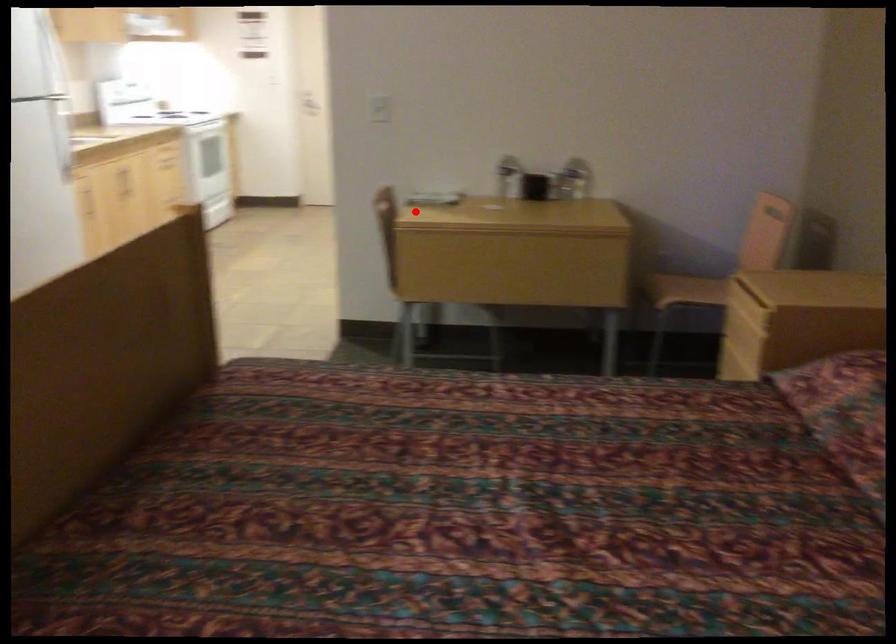
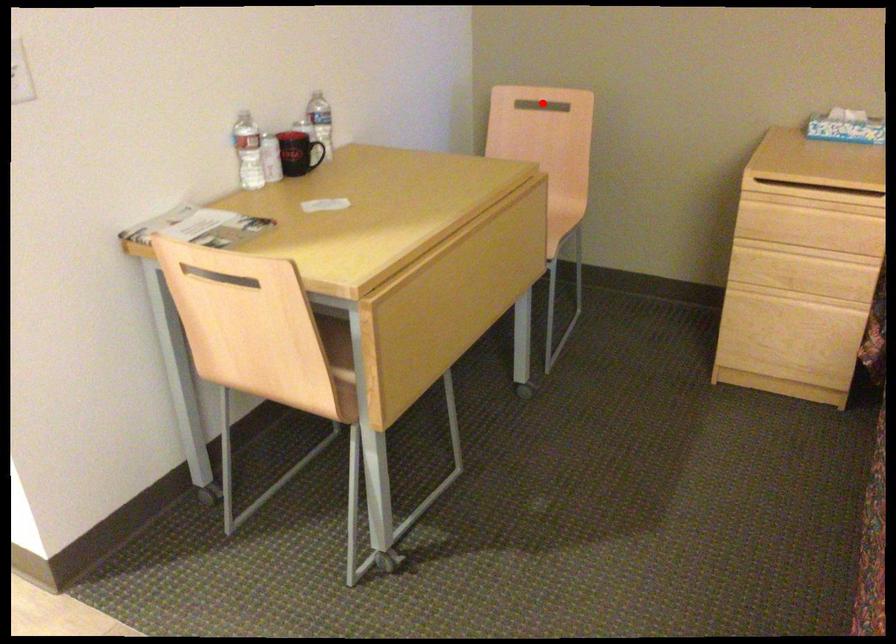
I am providing you with two images of the same scene from different viewpoints. A red point is marked on the first image and another point is marked on the second image. Is the red point in image1 aligned with the point shown in image2?

No